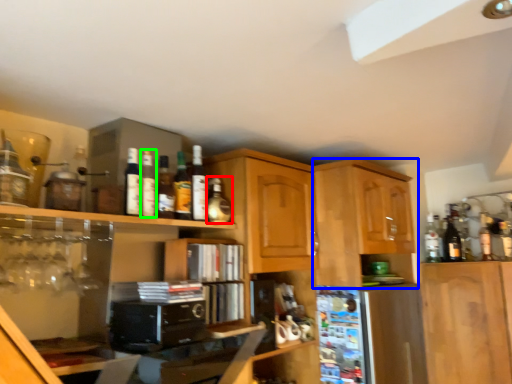
Question: Estimate the real-world distances between objects in this image. Which object is farther from bottle (highlighted by a red box), cabinetry (highlighted by a blue box) or bottle (highlighted by a green box)?

Choices:
 (A) cabinetry
 (B) bottle

Answer: (A)